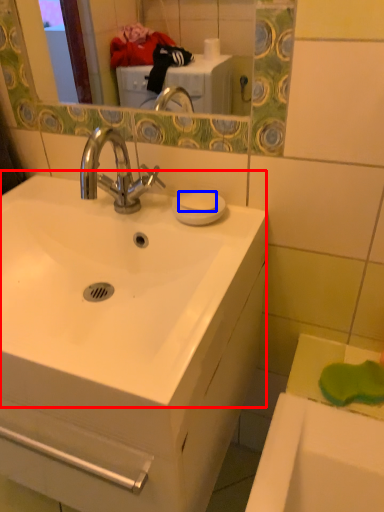
Question: Which point is further to the camera, sink (highlighted by a red box) or soap (highlighted by a blue box)?

Choices:
 (A) sink
 (B) soap

Answer: (B)